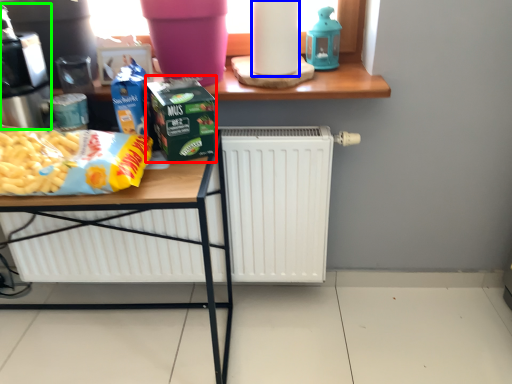
Question: Which object is the closest to the carton (highlighted by a red box)? Choose among these: paper towel (highlighted by a blue box) or coffee machine (highlighted by a green box).

Choices:
 (A) paper towel
 (B) coffee machine

Answer: (A)